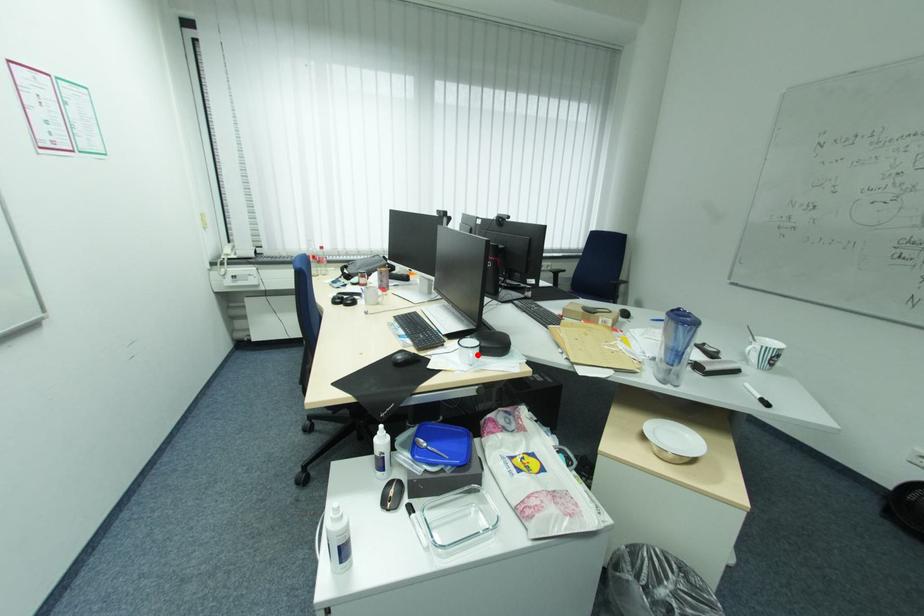
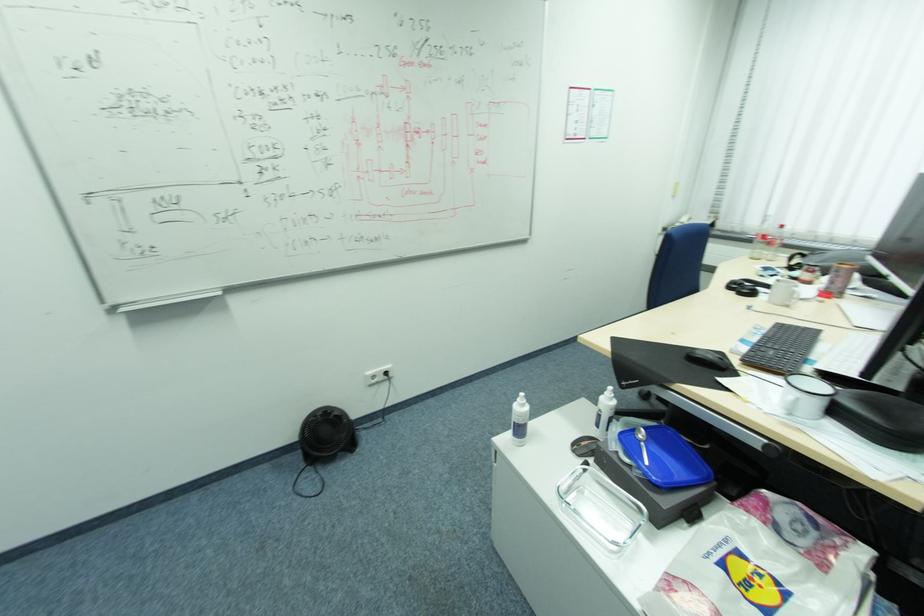
Find the pixel in the second image that matches the highlighted location in the first image.

(796, 397)